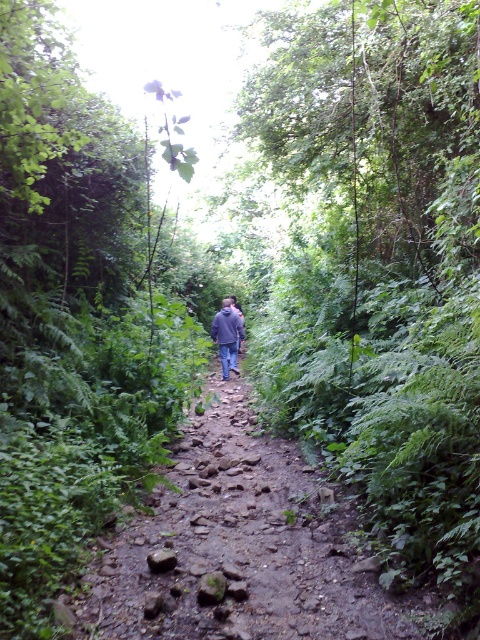
You are a hiker trying to navigate a narrow forest path. You see a point marked at coordinates (238, 547). Where on the path should you aim to step next?

You should aim to step at the point marked at coordinates (238, 547), as that is where the dusty stone path at center is located.

You are a hiker wearing the dark blue jeans at center and standing on the dusty stone path at center. You want to cross a small stream that suddenly appears ahead. The stream is narrow but has slippery rocks. Considering the height of the path, will your jeans get wet up to your knees?

The dusty stone path at center is not as tall as dark blue jeans at center, meaning the path is shorter than the jeans. Since the path is lower, water from the stream could splash up to the knees, potentially wetting the jeans.